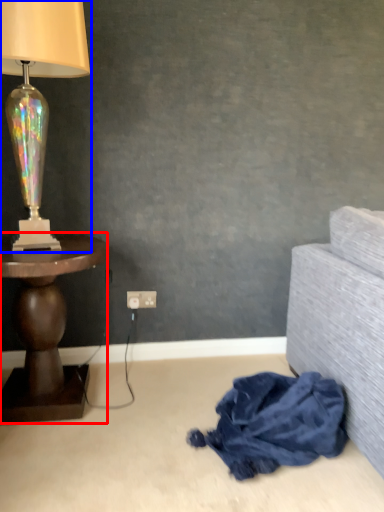
Question: Among these objects, which one is nearest to the camera, table (highlighted by a red box) or lamp (highlighted by a blue box)?

Choices:
 (A) table
 (B) lamp

Answer: (B)